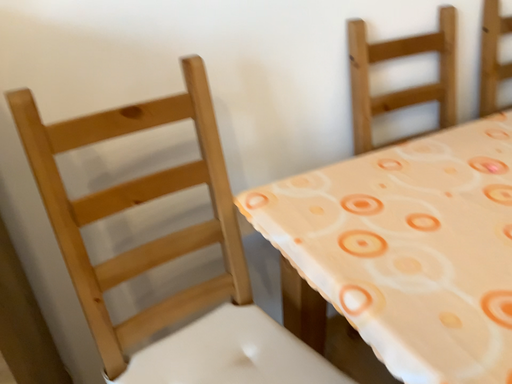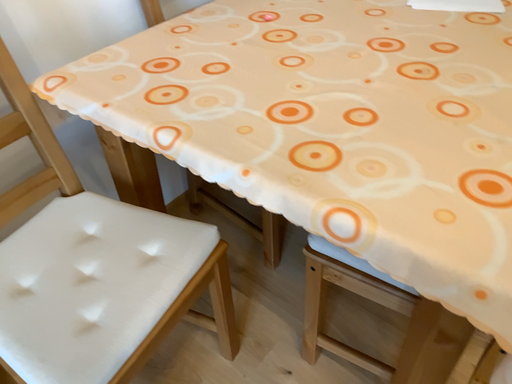
Question: Which way did the camera rotate in the video?

Choices:
 (A) rotated downward
 (B) rotated upward

Answer: (A)